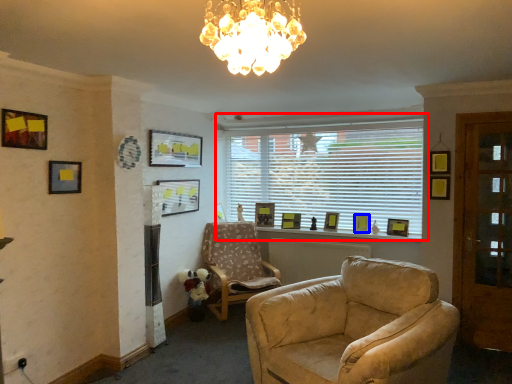
Question: Among these objects, which one is farthest to the camera, window (highlighted by a red box) or picture frame (highlighted by a blue box)?

Choices:
 (A) window
 (B) picture frame

Answer: (B)